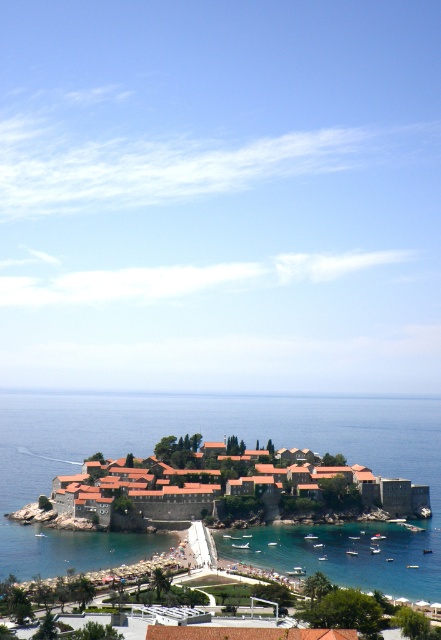
Question: In this image, where is blue water at center located relative to terracotta tiled roofs at center?

Choices:
 (A) left
 (B) right

Answer: (A)

Question: Which point is closer to the camera?

Choices:
 (A) terracotta tiled roofs at center
 (B) clear blue water at lower center
 (C) blue water at center

Answer: (B)

Question: Based on their relative distances, which object is farther from the clear blue water at lower center?

Choices:
 (A) blue water at center
 (B) terracotta tiled roofs at center

Answer: (A)

Question: Which point appears closest to the camera in this image?

Choices:
 (A) (86, 467)
 (B) (317, 540)

Answer: (B)

Question: Can you confirm if terracotta tiled roofs at center is positioned below clear blue water at lower center?

Choices:
 (A) no
 (B) yes

Answer: (A)

Question: Observing the image, what is the correct spatial positioning of terracotta tiled roofs at center in reference to clear blue water at lower center?

Choices:
 (A) below
 (B) above

Answer: (B)